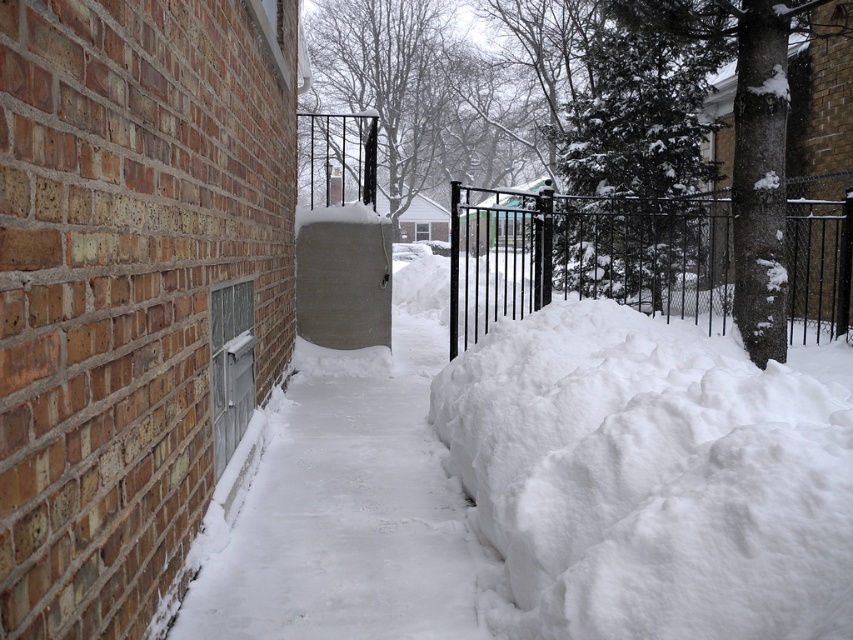
In the scene shown: You are standing at the entrance of a snowy path and want to walk towards the gate. Based on the scene, which object is closer to you, the white snow at center or the black wrought iron fence at center?

The white snow at center is closer to you since it is positioned to the left of the black wrought iron fence at center, indicating spatial proximity in the scene.